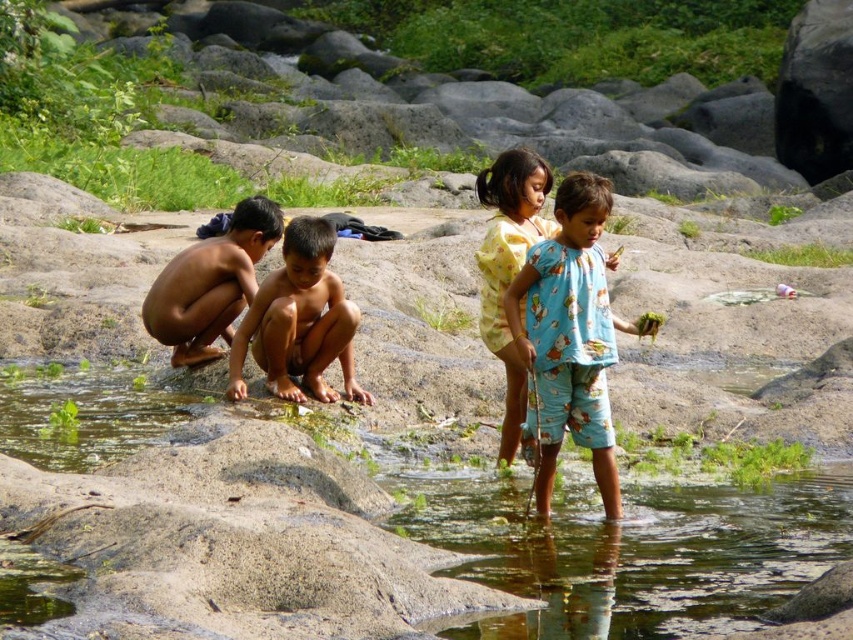
Question: Is brown skin boy at center bigger than brown skin boy at left?

Choices:
 (A) no
 (B) yes

Answer: (A)

Question: Does clear water at stream center have a larger size compared to brown skin boy at left?

Choices:
 (A) no
 (B) yes

Answer: (A)

Question: Which point is closer to the camera taking this photo?

Choices:
 (A) (561, 392)
 (B) (318, 244)
 (C) (697, 586)
 (D) (636, 484)

Answer: (C)

Question: Is the position of clear water at lower center more distant than that of brown skin boy at center?

Choices:
 (A) yes
 (B) no

Answer: (B)

Question: Which object is farther from the camera taking this photo?

Choices:
 (A) blue cotton pajamas at center
 (B) brown skin boy at left

Answer: (B)

Question: Which point is closer to the camera?

Choices:
 (A) blue cotton pajamas at center
 (B) brown skin boy at center

Answer: (A)